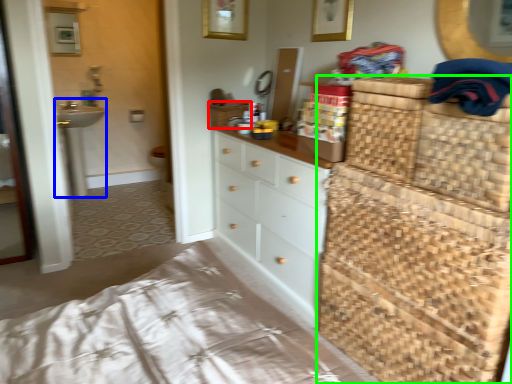
Question: Which is nearer to the basket (highlighted by a red box)? sink (highlighted by a blue box) or dresser (highlighted by a green box).

Choices:
 (A) sink
 (B) dresser

Answer: (B)